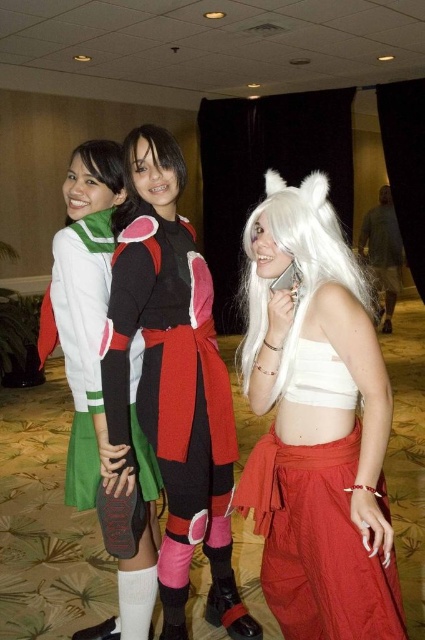
You are a photographer at a cosplay event and need to position two cosplayers with their skirts visible. The white fabric skirt at center and the green fabric skirt at center must be arranged so that their skirts are clearly visible. Based on their current positions, which cosplayer should you move to ensure both skirts are visible?

The white fabric skirt at center is to the right of the green fabric skirt at center. To ensure both skirts are visible, you should move the cosplayer with the green fabric skirt at center slightly to the left, creating space between them so both skirts can be seen clearly.

You are a photographer setting up for a group photo. You need to ensure that the white fabric skirt at center and the green fabric skirt at center are at least 24 inches apart to avoid overlapping in the frame. Based on the scene description, can you confirm if they are currently spaced adequately?

The distance between the white fabric skirt at center and the green fabric skirt at center is 23.52 inches, which is slightly less than the required 24 inches. Therefore, they are not adequately spaced to avoid overlapping in the frame.

You are standing at the point labeled point (90, 484) and want to move to the exit located at point (180, 636). Is the exit directly in front of you or behind you?

The exit at point (180, 636) is behind point (90, 484), so the exit is behind you.